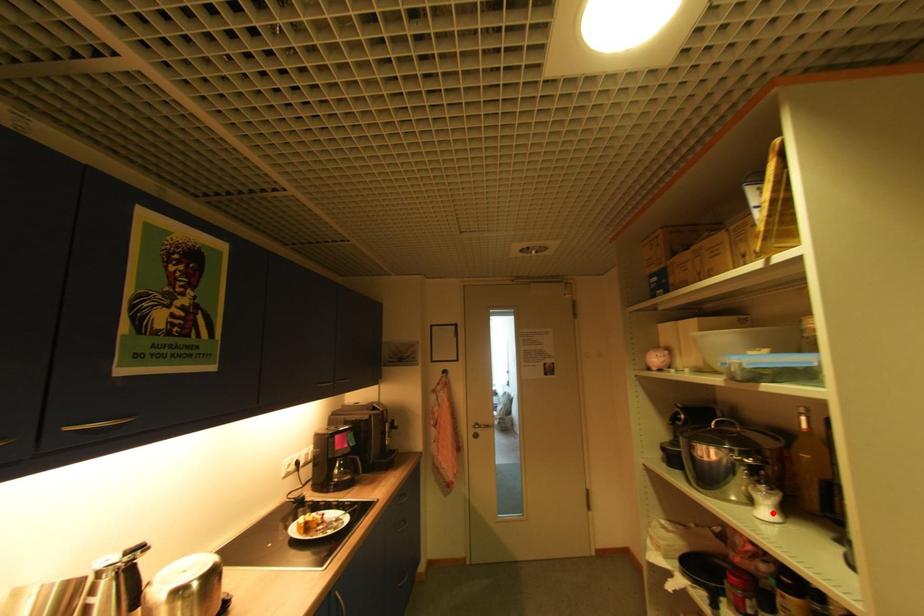
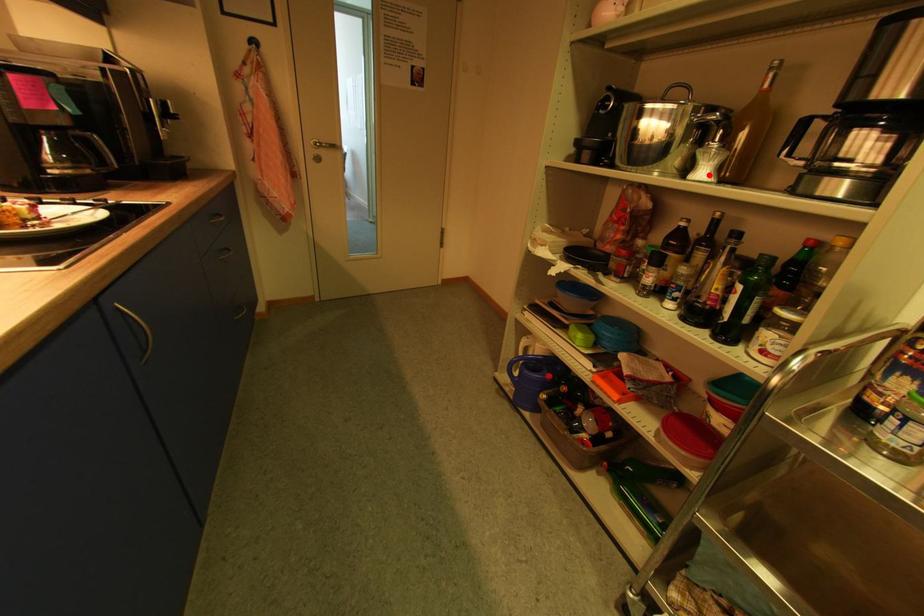
I am providing you with two images of the same scene from different viewpoints. A red point is marked on the first image and another point is marked on the second image. Are the points marked in image1 and image2 representing the same 3D position?

Yes